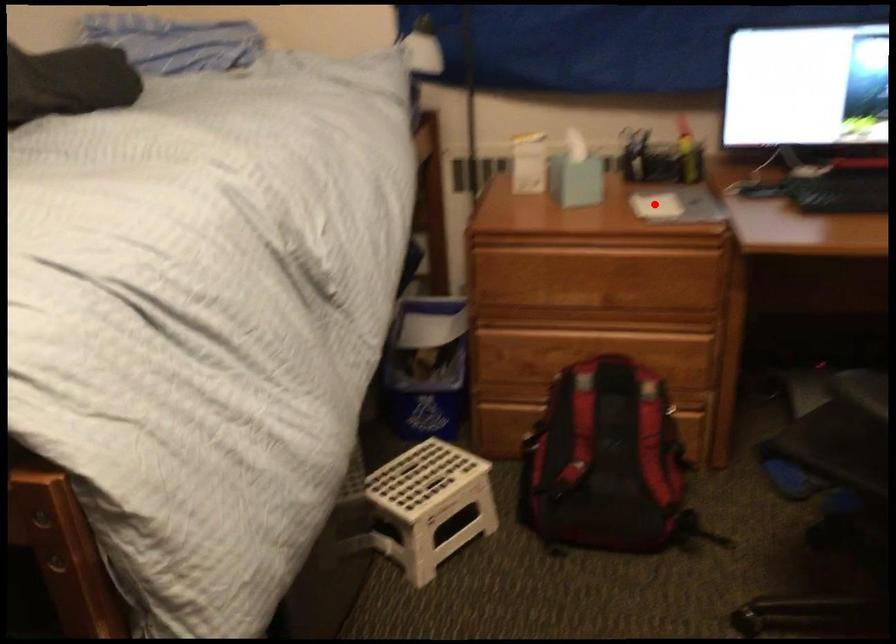
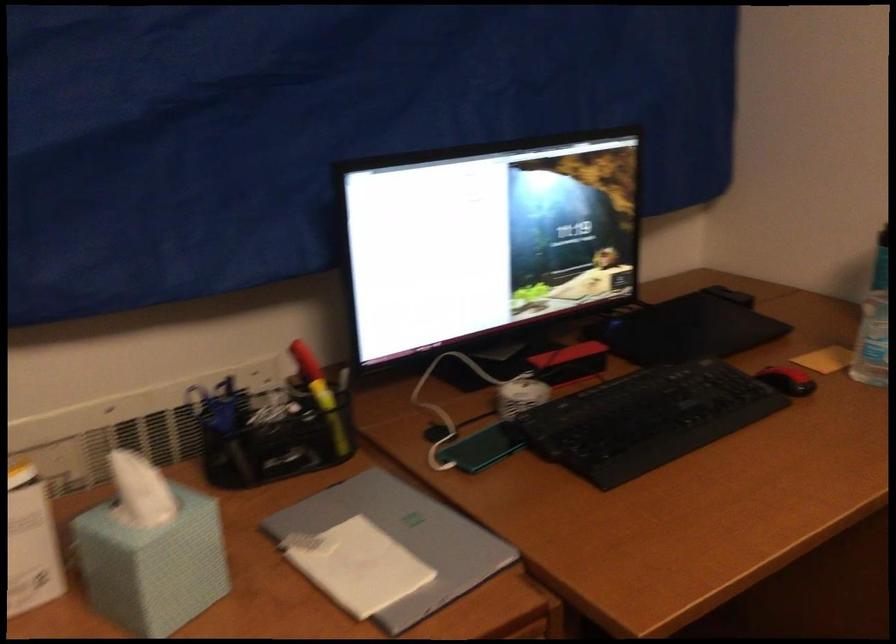
Where in the second image is the point corresponding to the highlighted location from the first image?

(357, 565)